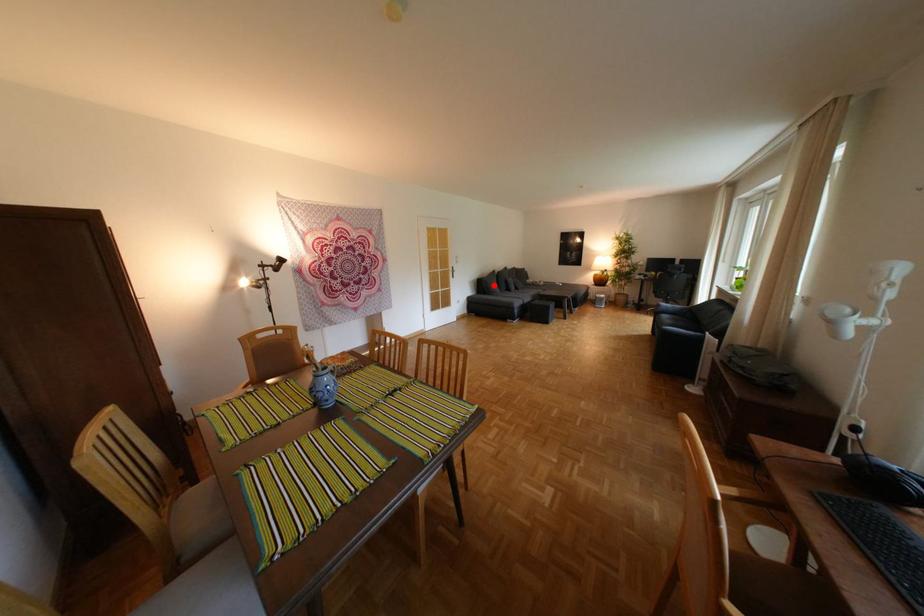
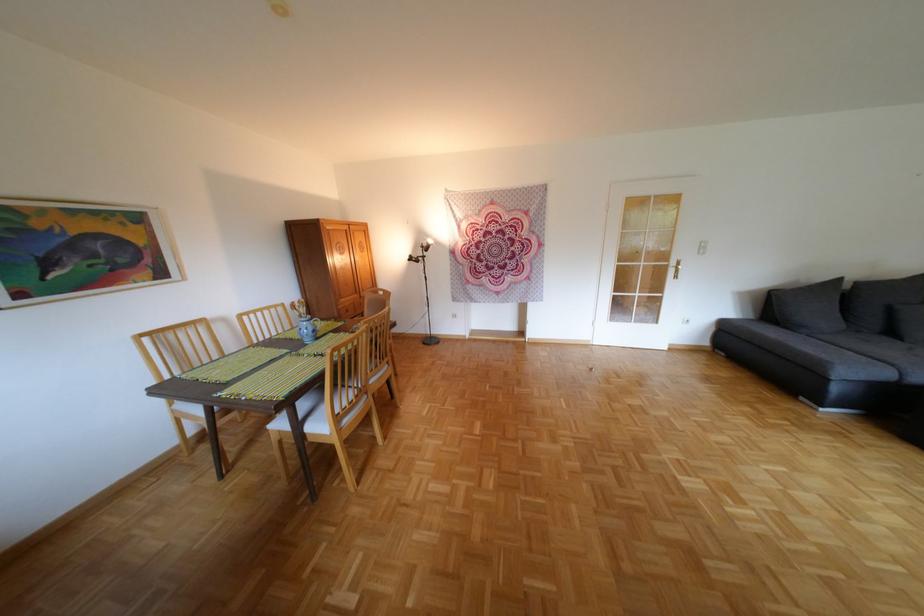
Find the pixel in the second image that matches the highlighted location in the first image.

(787, 304)